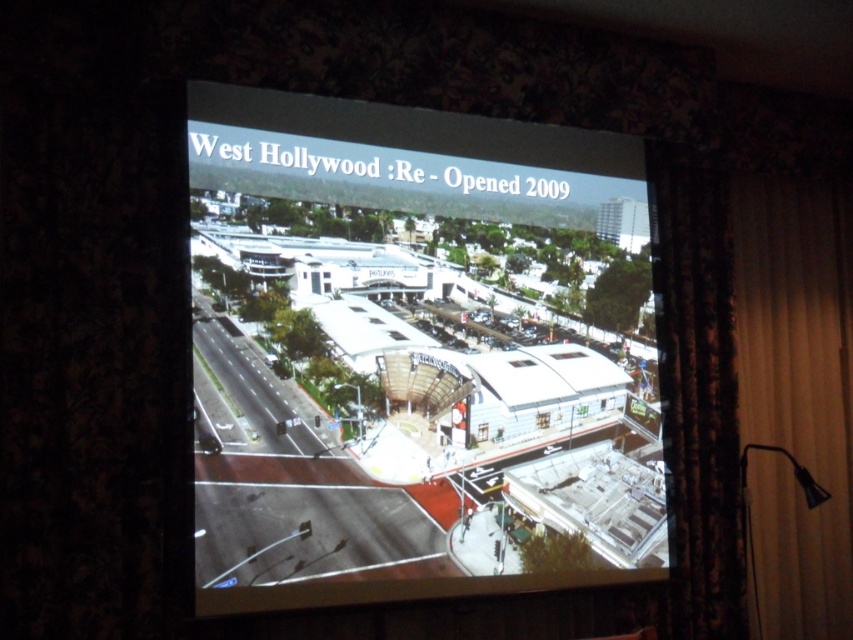
Who is positioned more to the right, white glossy building at center or beige fabric curtain at right?

beige fabric curtain at right is more to the right.

Who is taller, white glossy building at center or beige fabric curtain at right?

beige fabric curtain at right

Which is in front, point (550, 509) or point (779, 241)?

Positioned in front is point (550, 509).

Where is `white glossy building at center`? The width and height of the screenshot is (853, 640). white glossy building at center is located at coordinates (415, 355).

In the scene shown: Does beige fabric curtain at right appear over black floral curtain at right?

Actually, beige fabric curtain at right is below black floral curtain at right.

Which of these two, beige fabric curtain at right or black floral curtain at right, stands taller?

Standing taller between the two is beige fabric curtain at right.

At what (x,y) coordinates should I click in order to perform the action: click on beige fabric curtain at right. Please return your answer as a coordinate pair (x, y). The width and height of the screenshot is (853, 640). Looking at the image, I should click on (796, 396).

What do you see at coordinates (415, 355) in the screenshot?
I see `white glossy building at center` at bounding box center [415, 355].

Find the location of `white glossy building at center`. white glossy building at center is located at coordinates (415, 355).